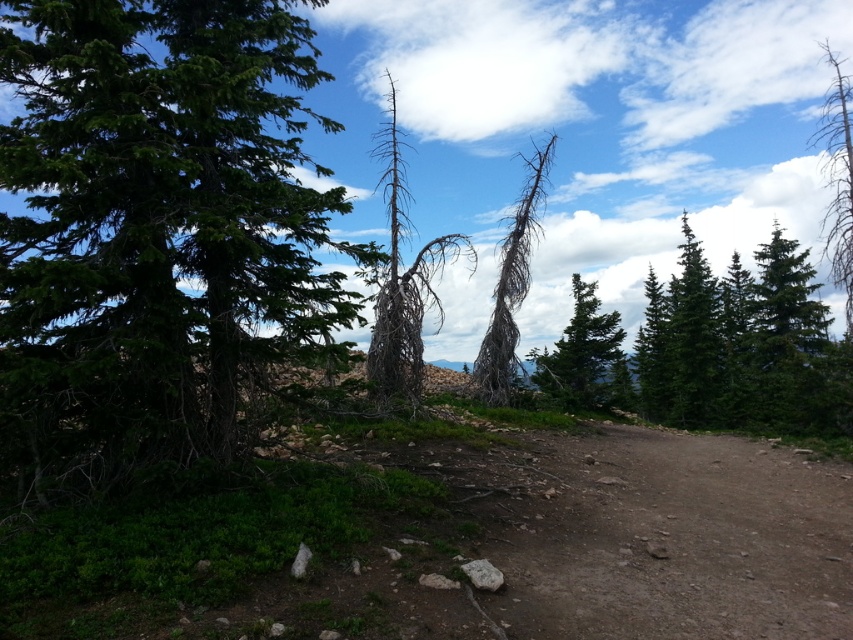
You are a hiker who wants to take a photo of both the green textured tree at upper center and the bare wood tree at upper right. Since you have a camera with a fixed focal length, you need to know their vertical arrangement. Which tree is positioned lower in the image?

The green textured tree at upper center is located below the bare wood tree at upper right, so it is positioned lower in the image.

You are standing at the center of the dirt path in the image and want to walk towards the two points marked as point [525,280] and point [598,371]. Which point should you head toward if you want to reach the one that is closer to you?

You should head toward point [525,280] because it is closer to the viewer than point [598,371] according to the description.